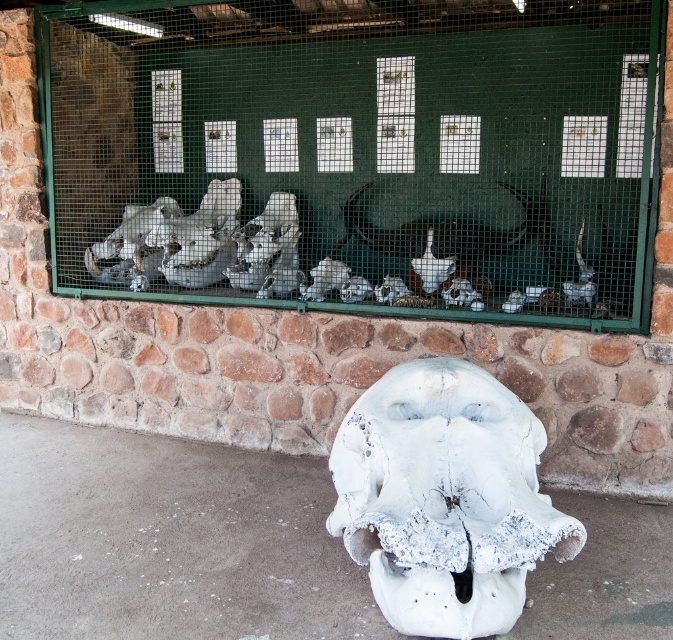
Can you confirm if white matte skull at center is thinner than white matte skull at lower center?

No.

Does white matte skull at center have a smaller size compared to white matte skull at lower center?

Incorrect, white matte skull at center is not smaller in size than white matte skull at lower center.

Is point (149, 172) positioned before point (351, 445)?

No, it is behind (351, 445).

This screenshot has height=640, width=673. In order to click on white matte skull at center in this screenshot , I will do `click(357, 154)`.